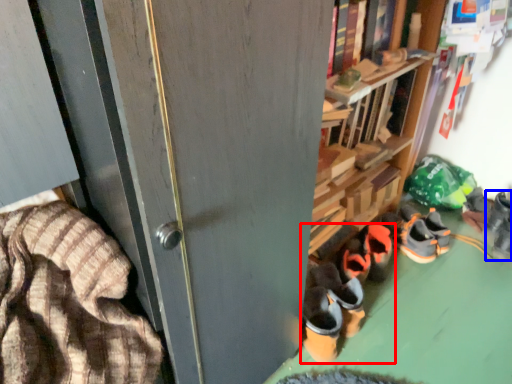
Question: Which object appears farthest to the camera in this image, footwear (highlighted by a red box) or footwear (highlighted by a blue box)?

Choices:
 (A) footwear
 (B) footwear

Answer: (B)